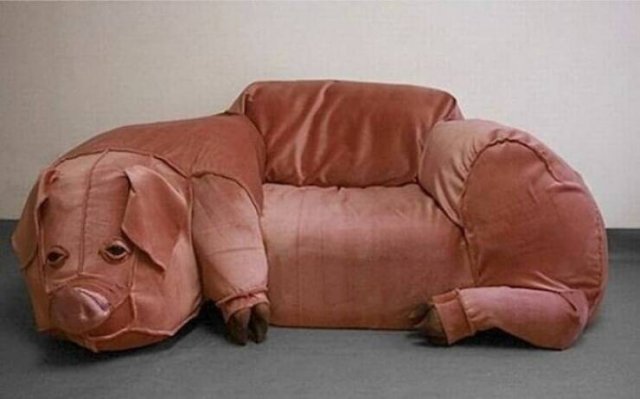
Find the location of `floor`. floor is located at coordinates (394, 368).